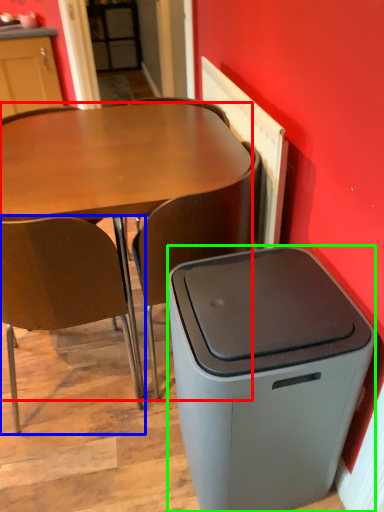
Question: Based on their relative distances, which object is farther from desk (highlighted by a red box)? Choose from chair (highlighted by a blue box) and trash bin/can (highlighted by a green box).

Choices:
 (A) chair
 (B) trash bin/can

Answer: (B)